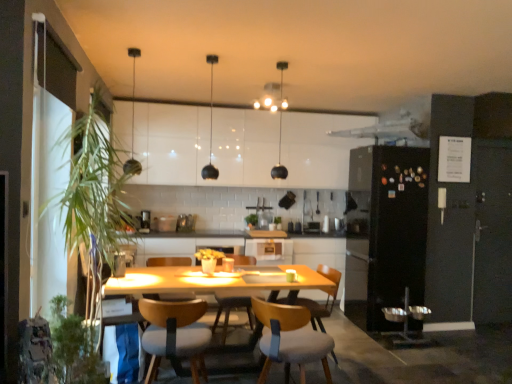
Describe the element at coordinates (386, 230) in the screenshot. The image size is (512, 384). I see `black glossy refrigerator at right` at that location.

Describe the element at coordinates (242, 147) in the screenshot. I see `white glossy cabinets at upper center, which is the first cabinetry in front-to-back order` at that location.

Measure the distance between point (x=75, y=323) and camera.

They are 2.31 meters apart.

In order to face metallic silver toaster at center, acting as the 1th appliance starting from the right, should I rotate leftwards or rightwards?

Turn left approximately 9.375 degrees to face it.

The height and width of the screenshot is (384, 512). Identify the location of satin black coffee machine at center, the 1th appliance when ordered from left to right. (145, 221).

Describe the element at coordinates (145, 221) in the screenshot. The height and width of the screenshot is (384, 512). I see `satin black coffee machine at center, the second appliance viewed from the right` at that location.

Locate an element on the screen. wooden chair with blue cushion at center, the first chair viewed from the front is located at coordinates (290, 339).

Can you confirm if green leafy plant at lower left, the third plant from the back, is smaller than metallic silver toaster at center, acting as the 1th appliance starting from the right?

No.

Where is `appliance on the right of the green leafy plant at lower left, the second plant when ordered from right to left`? The width and height of the screenshot is (512, 384). appliance on the right of the green leafy plant at lower left, the second plant when ordered from right to left is located at coordinates pyautogui.click(x=185, y=223).

From a real-world perspective, is green leafy plant at lower left, arranged as the first plant when viewed from the front, above or below metallic silver toaster at center, acting as the 1th appliance starting from the right?

green leafy plant at lower left, arranged as the first plant when viewed from the front, is situated lower than metallic silver toaster at center, acting as the 1th appliance starting from the right, in the real world.

Which of these two, green leafy plant at lower left, the third plant from the back, or metallic silver toaster at center, which is the 2th appliance from left to right, is thinner?

metallic silver toaster at center, which is the 2th appliance from left to right, is thinner.

Based on the photo, which of these two, black glossy refrigerator at right or wooden chair with cushion at center, acting as the 3th chair starting from the back, is wider?

black glossy refrigerator at right is wider.

Is point (419, 162) closer or farther from the camera than point (193, 351)?

Point (419, 162) appears to be farther away from the viewer than point (193, 351).

Where is `fridge located on the right of wooden chair with cushion at center, the second chair from the front`? fridge located on the right of wooden chair with cushion at center, the second chair from the front is located at coordinates (386, 230).

Considering the relative positions of black glossy refrigerator at right and green leafy plant at center, the first plant from the right, in the image provided, is black glossy refrigerator at right to the left of green leafy plant at center, the first plant from the right, from the viewer's perspective?

No.

Consider the image. From a real-world perspective, which is physically below, black glossy refrigerator at right or green leafy plant at center, the 1th plant when ordered from back to front?

black glossy refrigerator at right is physically lower.

Considering the relative sizes of black glossy refrigerator at right and green leafy plant at center, which appears as the 3th plant when viewed from the front, in the image provided, is black glossy refrigerator at right wider than green leafy plant at center, which appears as the 3th plant when viewed from the front,?

Yes, black glossy refrigerator at right is wider than green leafy plant at center, which appears as the 3th plant when viewed from the front.

Does wooden chair at center, acting as the first chair starting from the back, have a larger size compared to green leafy plant at lower left, which is counted as the second plant, starting from the left?

Indeed, wooden chair at center, acting as the first chair starting from the back, has a larger size compared to green leafy plant at lower left, which is counted as the second plant, starting from the left.

From the image's perspective, is wooden chair at center, the fourth chair from the front, under green leafy plant at lower left, which is counted as the second plant, starting from the left?

Correct, wooden chair at center, the fourth chair from the front, appears lower than green leafy plant at lower left, which is counted as the second plant, starting from the left, in the image.

From a real-world perspective, is wooden chair at center, acting as the first chair starting from the back, physically below green leafy plant at lower left, which is counted as the second plant, starting from the left?

Yes, from a real-world perspective, wooden chair at center, acting as the first chair starting from the back, is beneath green leafy plant at lower left, which is counted as the second plant, starting from the left.

Which is more distant, (217, 297) or (56, 298)?

The point (217, 297) is farther.

From the image's perspective, is black glossy refrigerator at right located above or below matte black pendant light at upper center, which is the first light fixture in left-to-right order?

From the image's perspective, black glossy refrigerator at right appears below matte black pendant light at upper center, which is the first light fixture in left-to-right order.

Is black glossy refrigerator at right in front of or behind matte black pendant light at upper center, which is the first light fixture in left-to-right order, in the image?

Visually, black glossy refrigerator at right is located behind matte black pendant light at upper center, which is the first light fixture in left-to-right order.

Is black glossy refrigerator at right to the right of matte black pendant light at upper center, placed as the third light fixture when sorted from right to left, from the viewer's perspective?

Correct, you'll find black glossy refrigerator at right to the right of matte black pendant light at upper center, placed as the third light fixture when sorted from right to left.

Is metallic silver toaster at center, which is the 2th appliance from left to right, facing towards green leafy plant at left, positioned as the 2th plant in front-to-back order?

No, metallic silver toaster at center, which is the 2th appliance from left to right, does not turn towards green leafy plant at left, positioned as the 2th plant in front-to-back order.

From the image's perspective, is metallic silver toaster at center, acting as the 1th appliance starting from the right, located above green leafy plant at left, positioned as the 2th plant in front-to-back order?

Incorrect, from the image's perspective, metallic silver toaster at center, acting as the 1th appliance starting from the right, is lower than green leafy plant at left, positioned as the 2th plant in front-to-back order.

Based on the photo, from a real-world perspective, between metallic silver toaster at center, acting as the 1th appliance starting from the right, and green leafy plant at left, which is the third plant from right to left, who is vertically lower?

From a 3D spatial view, metallic silver toaster at center, acting as the 1th appliance starting from the right, is below.

Is metallic silver toaster at center, which is the 2th appliance from left to right, far from green leafy plant at left, positioned as the 2th plant in front-to-back order?

That's right, there is a large distance between metallic silver toaster at center, which is the 2th appliance from left to right, and green leafy plant at left, positioned as the 2th plant in front-to-back order.

Can you confirm if black matte pendant light at center, acting as the 2th light fixture starting from the left, is smaller than wooden chair with blue cushion at center, which is the 4th chair from back to front?

Yes, black matte pendant light at center, acting as the 2th light fixture starting from the left, is smaller than wooden chair with blue cushion at center, which is the 4th chair from back to front.

Is black matte pendant light at center, arranged as the second light fixture when viewed from the right, turned away from wooden chair with blue cushion at center, which is the 4th chair from back to front?

black matte pendant light at center, arranged as the second light fixture when viewed from the right, does not have its back to wooden chair with blue cushion at center, which is the 4th chair from back to front.

Are black matte pendant light at center, acting as the 2th light fixture starting from the left, and wooden chair with blue cushion at center, the first chair viewed from the front, located far from each other?

Yes, black matte pendant light at center, acting as the 2th light fixture starting from the left, and wooden chair with blue cushion at center, the first chair viewed from the front, are quite far apart.

Is black matte pendant light at center, arranged as the second light fixture when viewed from the right, outside of wooden chair with blue cushion at center, the first chair viewed from the front?

Yes.

Find the location of a particular element. Image resolution: width=512 pixels, height=384 pixels. appliance that is the 2nd object located behind the green leafy plant at lower left, the third plant from the back is located at coordinates (185, 223).

Locate an element on the screen. This screenshot has width=512, height=384. fridge on the right side of wooden chair with cushion at center, the second chair from the front is located at coordinates (386, 230).

Considering their positions, is matte black pendant light at center, which is the 3th light fixture in left-to-right order, positioned closer to white glossy cabinets at upper center, marked as the second cabinetry in a right-to-left arrangement, than white glossy cabinet at center, the 1th cabinetry when ordered from right to left?

matte black pendant light at center, which is the 3th light fixture in left-to-right order, lies closer to white glossy cabinets at upper center, marked as the second cabinetry in a right-to-left arrangement, than the other object.

From the image, which object appears to be nearer to wooden chair with cushion at center, acting as the 3th chair starting from the back, white glossy cabinets at upper center, the first cabinetry when ordered from top to bottom, or satin black coffee machine at center, the second appliance viewed from the right?

satin black coffee machine at center, the second appliance viewed from the right, is closer to wooden chair with cushion at center, acting as the 3th chair starting from the back.

Considering their positions, is green leafy plant at lower left, the third plant from the back, positioned closer to matte black pendant light at center, placed as the first light fixture when sorted from right to left, than white glossy cabinet at center, the first cabinetry in the bottom-to-top sequence?

white glossy cabinet at center, the first cabinetry in the bottom-to-top sequence, is positioned closer to the anchor matte black pendant light at center, placed as the first light fixture when sorted from right to left.

Which object lies nearer to the anchor point wooden chair with cushion at center, the third chair from the front, green leafy plant at lower left, which is counted as the second plant, starting from the left, or white glossy cabinet at center, arranged as the 1th cabinetry when viewed from the back?

white glossy cabinet at center, arranged as the 1th cabinetry when viewed from the back, is closer to wooden chair with cushion at center, the third chair from the front.

When comparing their distances from white glossy cabinets at upper center, which is the first cabinetry in front-to-back order, does wooden chair with cushion at center, which is counted as the second chair, starting from the back, or green leafy plant at lower left, which is counted as the second plant, starting from the left, seem closer?

Among the two, wooden chair with cushion at center, which is counted as the second chair, starting from the back, is located nearer to white glossy cabinets at upper center, which is the first cabinetry in front-to-back order.

Based on their spatial positions, is satin black coffee machine at center, the 1th appliance when ordered from left to right, or white glossy cabinet at center, which ranks as the second cabinetry in top-to-bottom order, further from black matte pendant light at center, acting as the 2th light fixture starting from the left?

white glossy cabinet at center, which ranks as the second cabinetry in top-to-bottom order, is further to black matte pendant light at center, acting as the 2th light fixture starting from the left.

Estimate the real-world distances between objects in this image. Which object is closer to black glossy refrigerator at right, white glossy cabinets at upper center, marked as the second cabinetry in a right-to-left arrangement, or metallic silver toaster at center, acting as the 1th appliance starting from the right?

white glossy cabinets at upper center, marked as the second cabinetry in a right-to-left arrangement, is closer to black glossy refrigerator at right.

Based on their spatial positions, is wooden chair with cushion at center, which is counted as the second chair, starting from the back, or matte black pendant light at center, which is the 3th light fixture in left-to-right order, further from green leafy plant at lower left, the third plant from the back?

The object further to green leafy plant at lower left, the third plant from the back, is matte black pendant light at center, which is the 3th light fixture in left-to-right order.

Identify the location of fridge located between green leafy plant at left, which is the third plant from right to left, and green leafy plant at center, the 1th plant when ordered from back to front, in the depth direction. (386, 230).

Locate an element on the screen. The width and height of the screenshot is (512, 384). plant between green leafy plant at lower left, the second plant when ordered from right to left, and matte black pendant light at center, which is the 3th light fixture in left-to-right order, in the front-back direction is located at coordinates (94, 185).

This screenshot has height=384, width=512. In order to click on cabinetry positioned between green leafy plant at lower left, the second plant when ordered from right to left, and white glossy cabinet at center, which ranks as the second cabinetry in top-to-bottom order, from near to far in this screenshot , I will do `click(242, 147)`.

At what (x,y) coordinates should I click in order to perform the action: click on fridge between matte black pendant light at center, which is the 3th light fixture in left-to-right order, and wooden chair with cushion at center, the third chair from the front, in the up-down direction. Please return your answer as a coordinate pair (x, y). Image resolution: width=512 pixels, height=384 pixels. Looking at the image, I should click on 386,230.